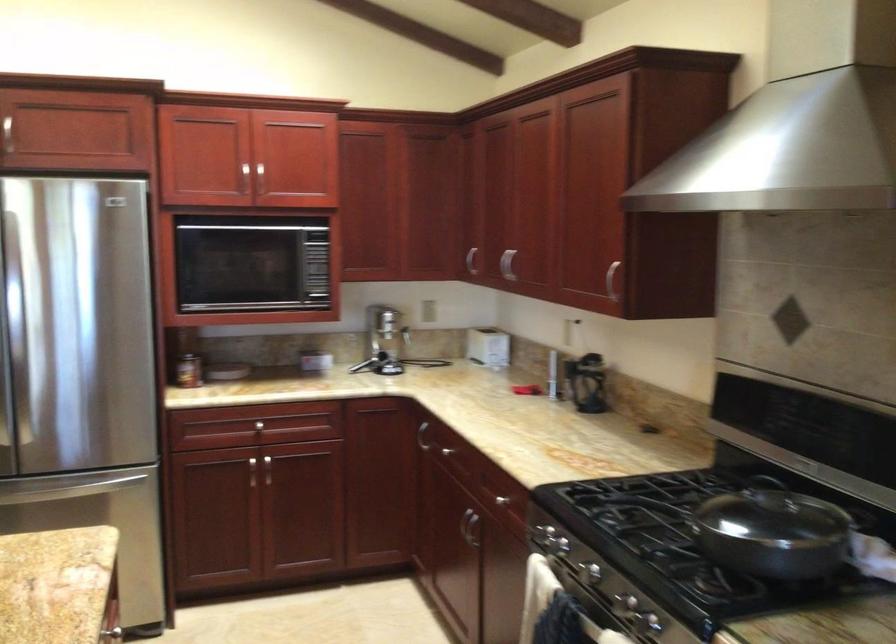
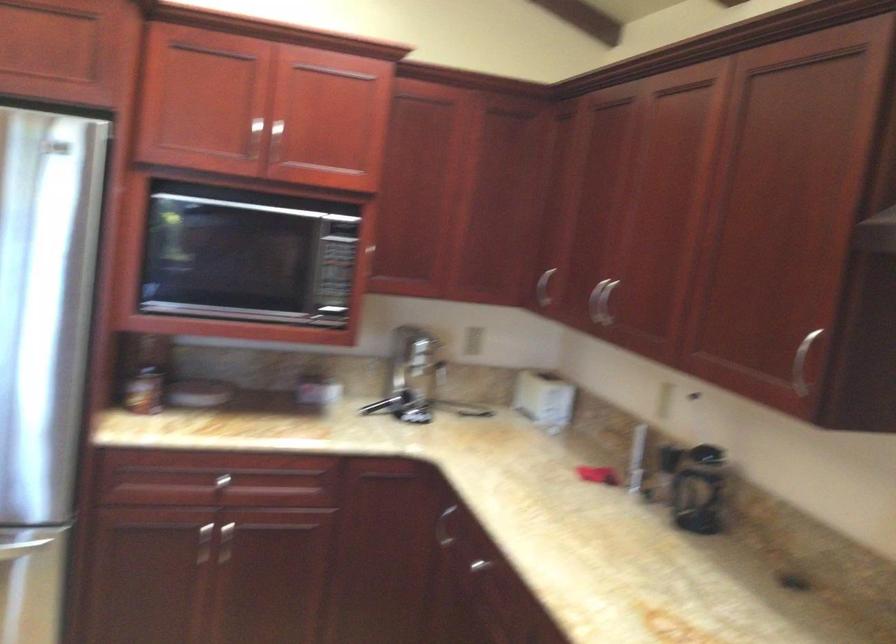
Find the pixel in the second image that matches point (485, 344) in the first image.

(544, 398)